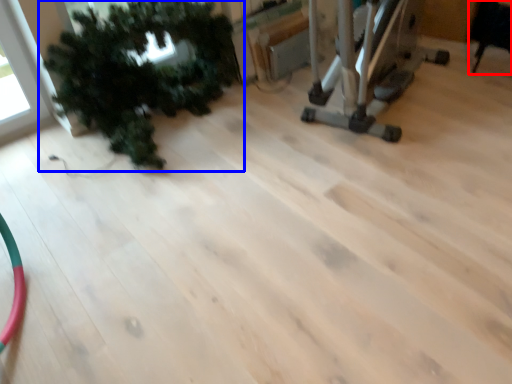
Question: Which of the following is the farthest to the observer, chair (highlighted by a red box) or houseplant (highlighted by a blue box)?

Choices:
 (A) chair
 (B) houseplant

Answer: (A)